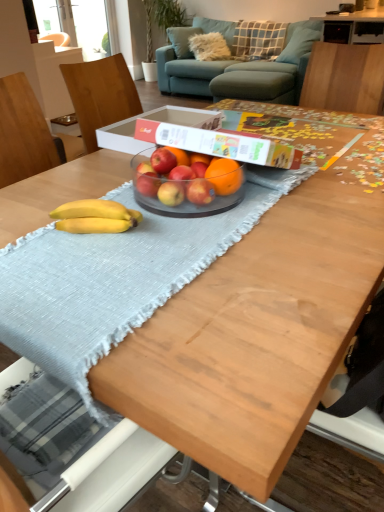
This screenshot has width=384, height=512. Find the location of `free space to the left of red matte apple at center, marked as the 1th apple in a right-to-left arrangement`. free space to the left of red matte apple at center, marked as the 1th apple in a right-to-left arrangement is located at coordinates (136, 209).